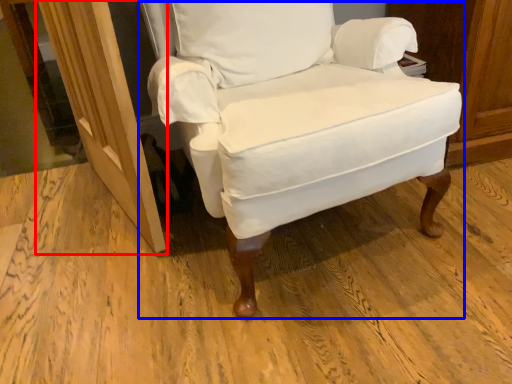
Question: Among these objects, which one is nearest to the camera, screen door (highlighted by a red box) or chair (highlighted by a blue box)?

Choices:
 (A) screen door
 (B) chair

Answer: (B)